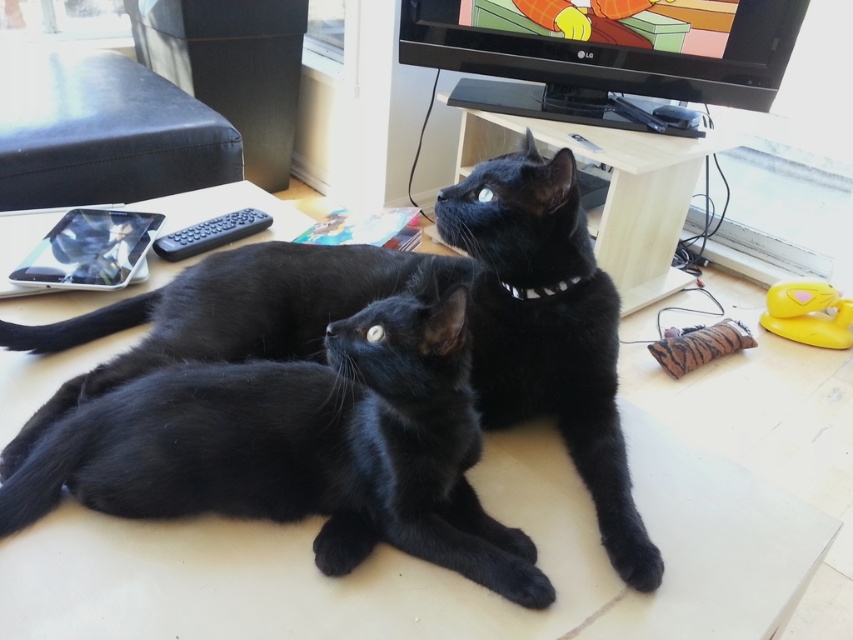
Can you confirm if shiny black cat at center is thinner than white plastic collar at center?

No.

Who is more forward, [363,252] or [519,291]?

Positioned in front is point [519,291].

This screenshot has height=640, width=853. I want to click on shiny black cat at center, so click(x=427, y=301).

Locate an element on the screen. shiny black cat at center is located at coordinates (427, 301).